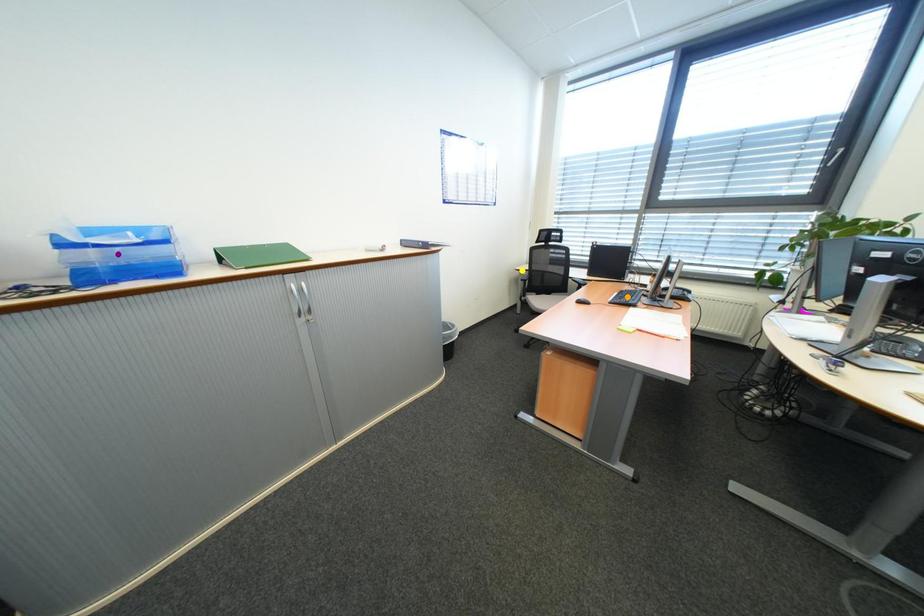
Order these from nearest to farthest:
A) orange point
B) purple point
C) yellow point

1. purple point
2. orange point
3. yellow point